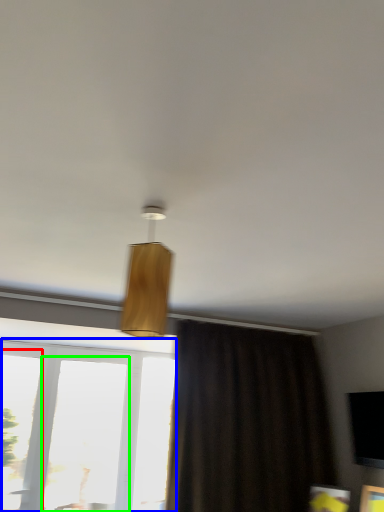
Question: Which is nearer to the window (highlighted by a red box)? window (highlighted by a blue box) or window (highlighted by a green box).

Choices:
 (A) window
 (B) window

Answer: (A)